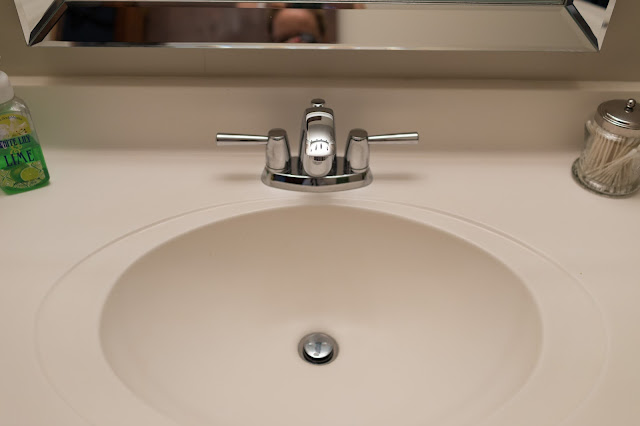
This screenshot has height=426, width=640. Identify the location of faucet. (319, 143).